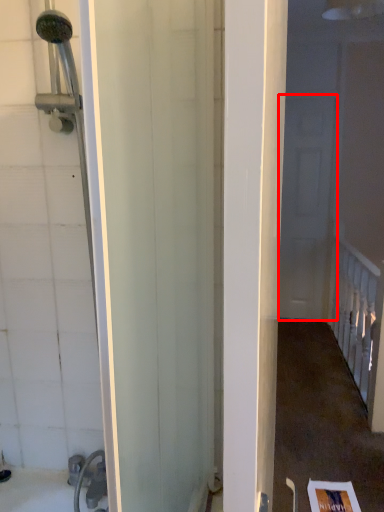
Question: Considering the relative positions of screen door (annotated by the red box) and rail in the image provided, where is screen door (annotated by the red box) located with respect to the staircase?

Choices:
 (A) left
 (B) right

Answer: (A)